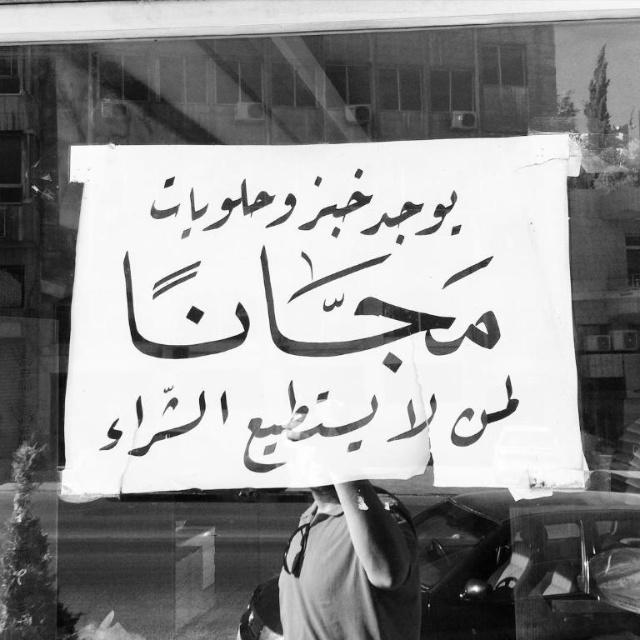
Question: Is white paper sign at center wider than transparent glass window at upper left?

Choices:
 (A) no
 (B) yes

Answer: (B)

Question: Which object is the closest to the dark gray t-shirt at center?

Choices:
 (A) transparent glass window at upper left
 (B) white paper sign at center

Answer: (B)

Question: Is white paper sign at center bigger than dark gray t-shirt at center?

Choices:
 (A) no
 (B) yes

Answer: (B)

Question: Does white paper sign at center appear on the left side of dark gray t-shirt at center?

Choices:
 (A) yes
 (B) no

Answer: (A)

Question: Estimate the real-world distances between objects in this image. Which object is farther from the white paper sign at center?

Choices:
 (A) dark gray t-shirt at center
 (B) transparent glass window at upper left

Answer: (B)

Question: Which point is closer to the camera?

Choices:
 (A) (3, 163)
 (B) (477, 221)

Answer: (B)